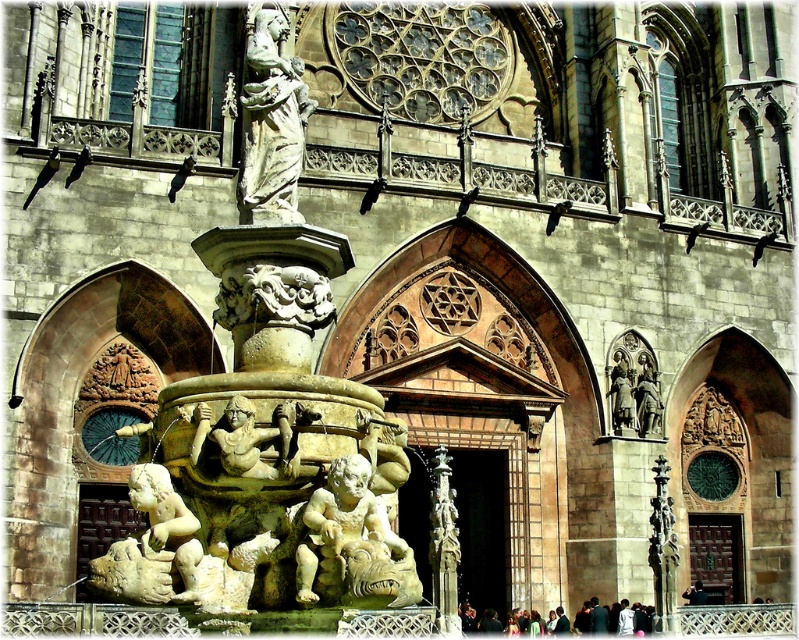
You are a tour guide leading a group through the cathedral grounds. You want to ensure that a 3.5 meter long banner can be stretched between the carved stone gargoyle at center and the white marble cherub at lower left without touching the ground. Is this possible?

The distance between the carved stone gargoyle at center and the white marble cherub at lower left is 3.07 meters, which is shorter than the 3.5 meter banner. Therefore, the banner cannot be stretched between them without touching the ground.

You are a maintenance worker needing to inspect both the white stone fountain at center and the carved stone gargoyle at center. You have a ladder that is 7 feet long. Can you reach both objects with your ladder without moving it?

The distance between the white stone fountain at center and the carved stone gargoyle at center is 8.02 feet. Since the ladder is only 7 feet long, it is not long enough to span the distance between them. You would need to move the ladder to reach both objects.

You are an architect examining the cathedral scene. You need to determine which object is smaller between the carved stone gargoyle at center and the white marble cherub at lower left. Which one is smaller?

The carved stone gargoyle at center is smaller compared to the white marble cherub at lower left.